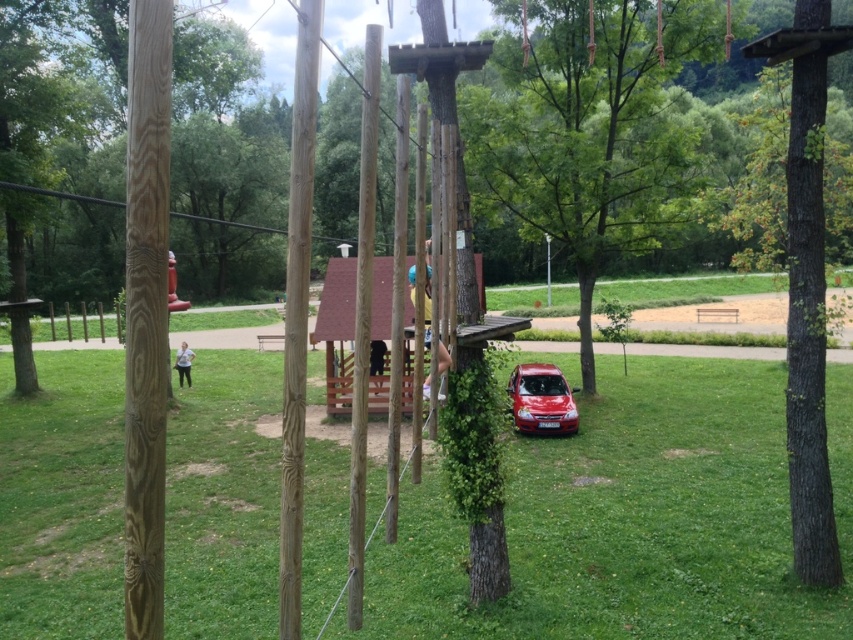
Does natural wood pole at left come in front of glossy red car at center-right?

Yes, natural wood pole at left is closer to the viewer.

Consider the image. Which is more to the right, natural wood pole at left or glossy red car at center-right?

glossy red car at center-right

Is point (131, 332) positioned in front of point (527, 424)?

Yes, it is in front of point (527, 424).

The image size is (853, 640). In order to click on natural wood pole at left in this screenshot , I will do pos(146,312).

Based on the photo, who is shorter, natural wood pole at left or green rough bark tree at center?

green rough bark tree at center is shorter.

Based on the photo, can you confirm if natural wood pole at left is bigger than green rough bark tree at center?

Yes, natural wood pole at left is bigger than green rough bark tree at center.

Between point (164, 134) and point (785, 177), which one is positioned behind?

The point (785, 177) is more distant.

The image size is (853, 640). In order to click on natural wood pole at left in this screenshot , I will do `click(146, 312)`.

Does natural wood pole at left come behind smooth wood pole at center?

No, it is not.

Who is shorter, natural wood pole at left or smooth wood pole at center?

Standing shorter between the two is natural wood pole at left.

Does point (137, 19) come closer to viewer compared to point (363, 410)?

Yes, it is in front of point (363, 410).

Locate an element on the screen. The image size is (853, 640). natural wood pole at left is located at coordinates (146, 312).